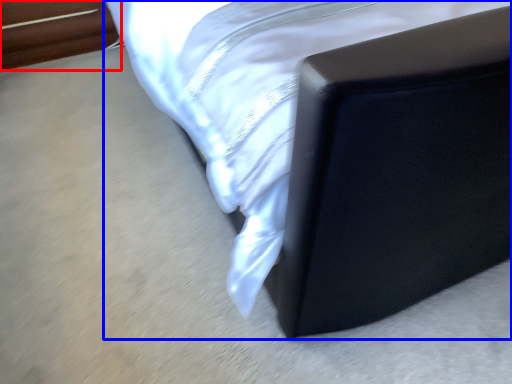
Question: Which point is closer to the camera, furniture (highlighted by a red box) or furniture (highlighted by a blue box)?

Choices:
 (A) furniture
 (B) furniture

Answer: (B)